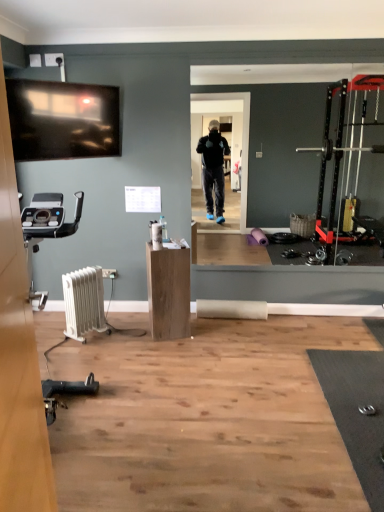
The width and height of the screenshot is (384, 512). I want to click on vacant area that lies between wooden cabinet at center and white plastic radiator at lower left, so click(125, 335).